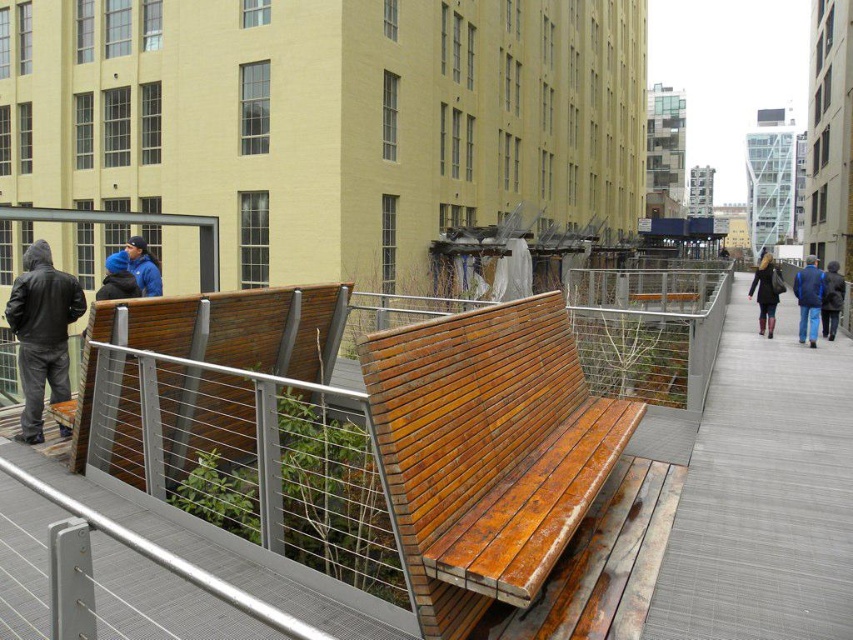
You are standing on the elevated walkway and looking at two points marked in the image. Which point, point (x=550, y=416) or point (x=157, y=285), is closer to you?

Point (x=550, y=416) is closer to you than point (x=157, y=285).

You are standing on the gray textured pavement at center and want to pick up the matte black coat at center right. Is the coat within your immediate reach without moving from the pavement?

The gray textured pavement at center is closer to the viewer than the matte black coat at center right, so the coat is further away. You would need to move closer to reach it.